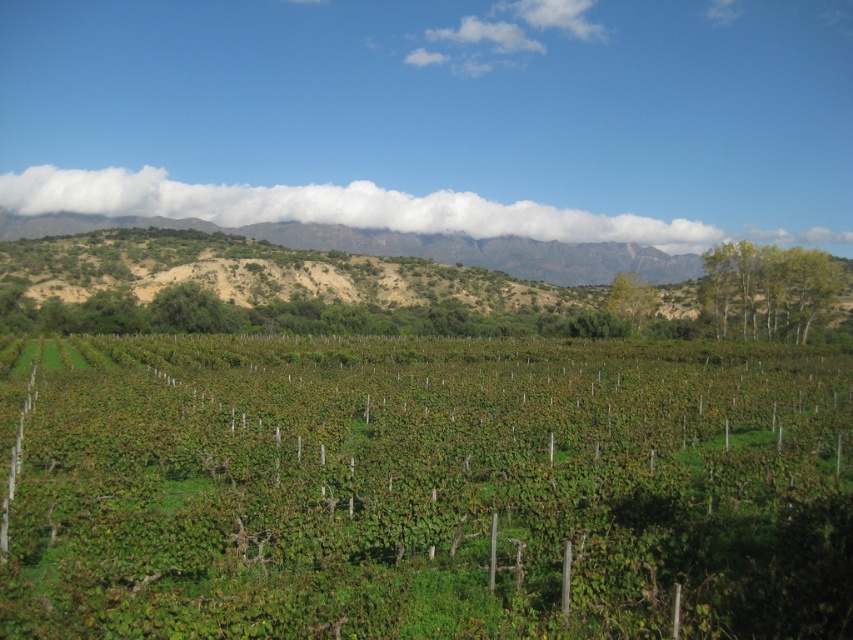
Question: Can you confirm if green leafy vineyard at center is positioned below green leafy tree at center?

Choices:
 (A) yes
 (B) no

Answer: (A)

Question: Can you confirm if green leafy tree at upper right is smaller than green leafy tree at center?

Choices:
 (A) no
 (B) yes

Answer: (A)

Question: Which point is closer to the camera taking this photo?

Choices:
 (A) (724, 324)
 (B) (645, 236)

Answer: (A)

Question: Which point is closer to the camera?

Choices:
 (A) green leafy tree at center
 (B) green leafy tree at upper right
 (C) green leafy vineyard at center
 (D) white fluffy cloud at upper center

Answer: (C)

Question: Is green leafy vineyard at center below green leafy tree at center?

Choices:
 (A) yes
 (B) no

Answer: (A)

Question: Considering the real-world distances, which object is closest to the green leafy tree at center?

Choices:
 (A) green leafy vineyard at center
 (B) white fluffy cloud at upper center

Answer: (A)